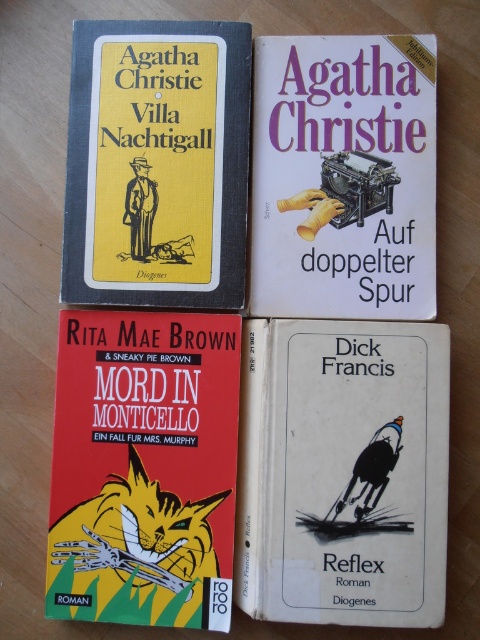
You are organizing a bookshelf and need to place the red matte book cover at bottom left and the white paper book at upper center side by side. Which book should you place first to ensure they fit properly?

You should place the red matte book cover at bottom left first because it might be wider than the white paper book at upper center, so placing the wider book first ensures proper fitting.